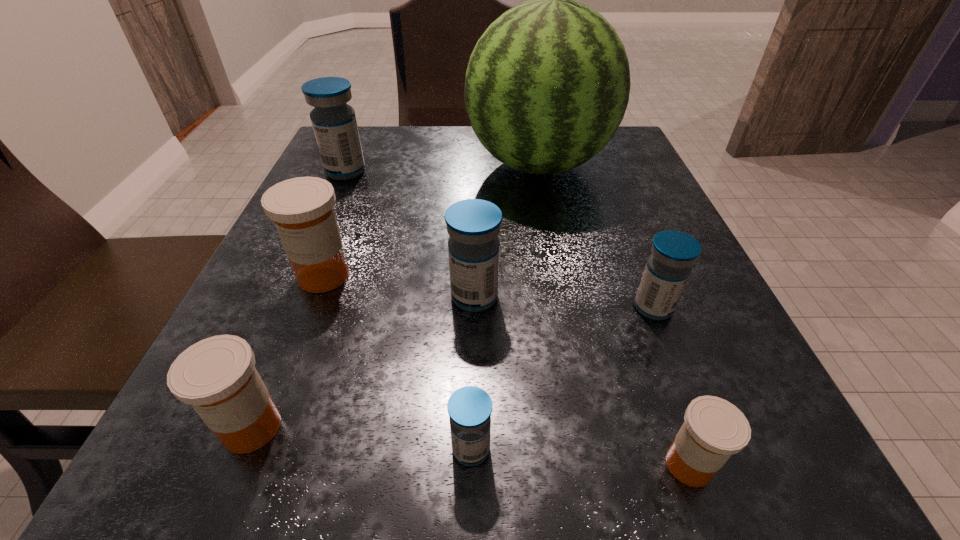
You are a GUI agent. You are given a task and a screenshot of the screen. Output one action in this format:
    pyautogui.click(x=<x>, y=<y>)
    Task: Click on the vacant space located 0.380m on the front of the tallest object
    The image size is (960, 540).
    Given the screenshot: What is the action you would take?
    pyautogui.click(x=579, y=373)

In order to click on free space located 0.160m on the front of the seventh shortest object in this screenshot , I will do `click(320, 230)`.

This screenshot has height=540, width=960. In order to click on free space located on the label of the biggest orange medicine in this screenshot , I will do `click(303, 327)`.

The width and height of the screenshot is (960, 540). I want to click on vacant space located on the right of the third smallest blue medicine, so click(679, 297).

Locate an element on the screen. The image size is (960, 540). free space located on the right of the second smallest blue medicine is located at coordinates (708, 308).

Where is `free space located on the left of the smallest blue medicine`? The image size is (960, 540). free space located on the left of the smallest blue medicine is located at coordinates (406, 449).

The height and width of the screenshot is (540, 960). Find the location of `vacant point located on the label of the smallest orange medicine`. vacant point located on the label of the smallest orange medicine is located at coordinates (442, 464).

Locate an element on the screen. The image size is (960, 540). vacant area situated 0.070m on the label of the smallest orange medicine is located at coordinates (598, 464).

What are the coordinates of `free spot located on the label of the smallest orange medicine` in the screenshot? It's located at (340, 464).

Where is `watermelon that is at the far edge`? The width and height of the screenshot is (960, 540). watermelon that is at the far edge is located at coordinates point(547,85).